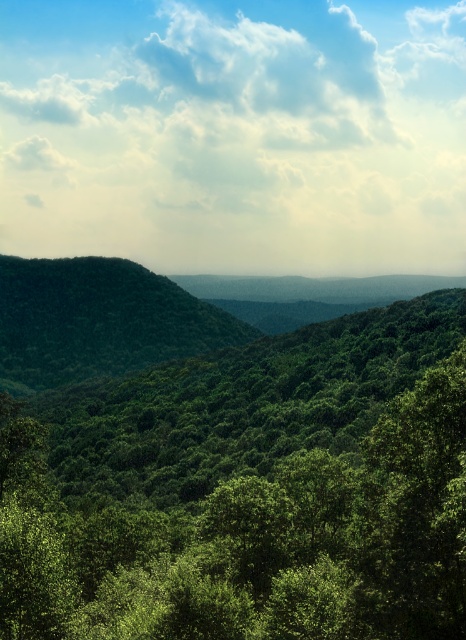
You are an environmental scientist assessing the forest health. You observe the green leafy tree at center and the green leafy hill at center. Which object would you prioritize for immediate inspection to determine potential threats to the forest ecosystem?

The green leafy tree at center is larger in size than the green leafy hill at center, so it would be the priority for immediate inspection as larger trees are often key indicators of forest health and potential threats.

You are a hiker standing in the forest and want to take a photo of the green leafy tree at center and the green leafy hill at center. Which object will appear smaller in the photo?

The green leafy tree at center will appear smaller in the photo because it has a lesser width compared to the green leafy hill at center.

You are a photographer standing in the forest and want to capture both the point at coordinates point (150, 483) and point (88, 268) in your shot. Which point should you focus on first to ensure both are in focus?

You should focus on point (150, 483) first because it is closer to the camera than point (88, 268), ensuring that both points will be in focus when using a proper depth of field.